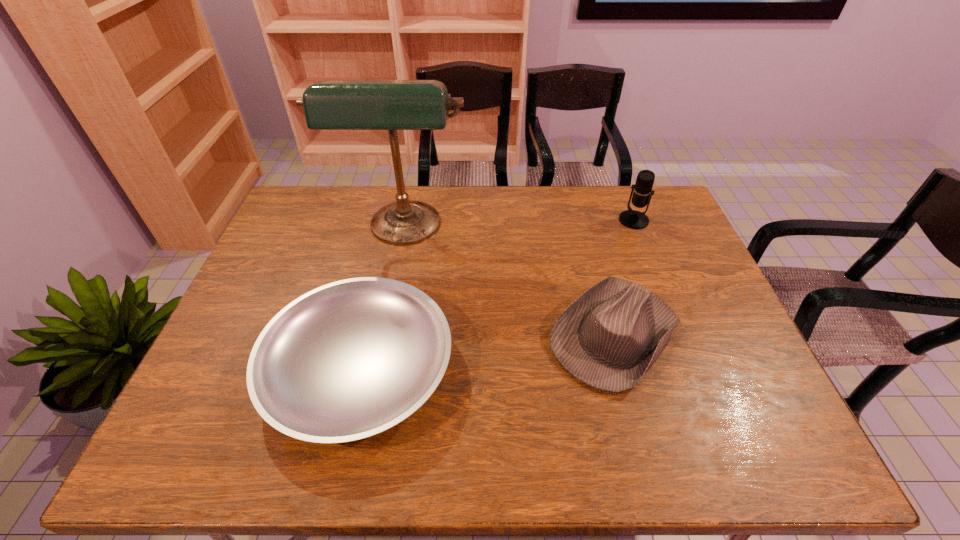
Locate an element on the screen. free spot between the second shortest object and the third shortest object is located at coordinates (625, 278).

I want to click on the closest object to the microphone, so click(608, 338).

Identify which object is the second nearest to the tallest object. Please provide its 2D coordinates. Your answer should be formatted as a tuple, i.e. [(x, y)], where the tuple contains the x and y coordinates of a point satisfying the conditions above.

[(608, 338)]

This screenshot has width=960, height=540. I want to click on blank space that satisfies the following two spatial constraints: 1. on the back side of the bedpan; 2. on the left side of the second tallest object, so click(x=394, y=220).

I want to click on free location that satisfies the following two spatial constraints: 1. on the back side of the microphone; 2. on the right side of the shortest object, so click(x=394, y=220).

Find the location of a particular element. free location that satisfies the following two spatial constraints: 1. above the green lampshade of the fedora; 2. on the left side of the tallest object is located at coordinates (385, 335).

Find the location of `vacant region that satisfies the following two spatial constraints: 1. above the green lampshade of the third tallest object; 2. on the right side of the tallest object`. vacant region that satisfies the following two spatial constraints: 1. above the green lampshade of the third tallest object; 2. on the right side of the tallest object is located at coordinates (385, 335).

Identify the location of free region that satisfies the following two spatial constraints: 1. on the back side of the second shortest object; 2. on the right side of the second tallest object. This screenshot has width=960, height=540. (585, 220).

Image resolution: width=960 pixels, height=540 pixels. Find the location of `free space in the image that satisfies the following two spatial constraints: 1. above the green lampshade of the second shortest object; 2. on the left side of the table lamp`. free space in the image that satisfies the following two spatial constraints: 1. above the green lampshade of the second shortest object; 2. on the left side of the table lamp is located at coordinates (385, 335).

Where is `free space that satisfies the following two spatial constraints: 1. on the back side of the fedora; 2. on the right side of the shortest object`? The height and width of the screenshot is (540, 960). free space that satisfies the following two spatial constraints: 1. on the back side of the fedora; 2. on the right side of the shortest object is located at coordinates (368, 335).